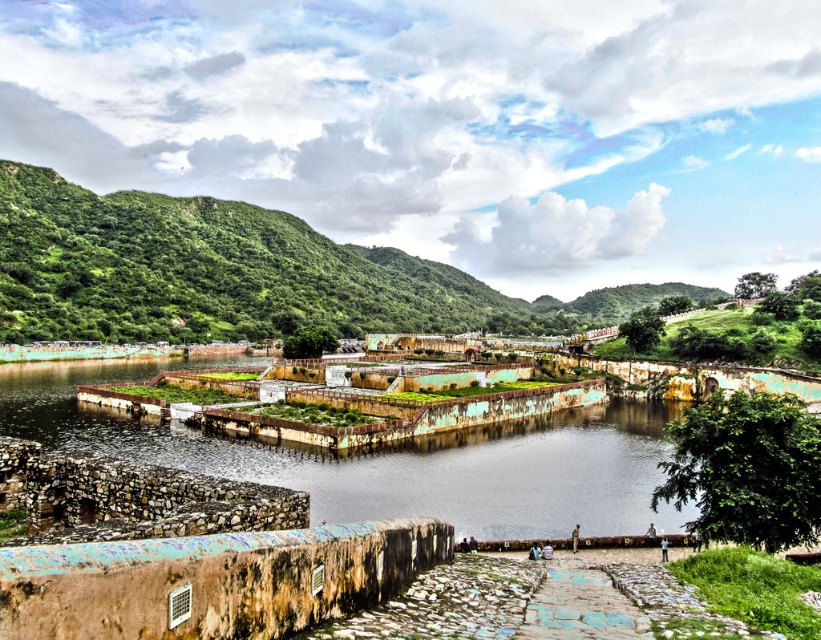
Based on the scene described, which object has a greater height between the green leafy hillside at upper left and the brown stone river at center?

The green leafy hillside at upper left has a greater height compared to the brown stone river at center.

You are standing at the stone pathway in the foreground of the image. You see a point marked at coordinates (237, 275). Where is this point located in relation to the scene?

The point at (237, 275) is located on the green leafy hillside at upper left.